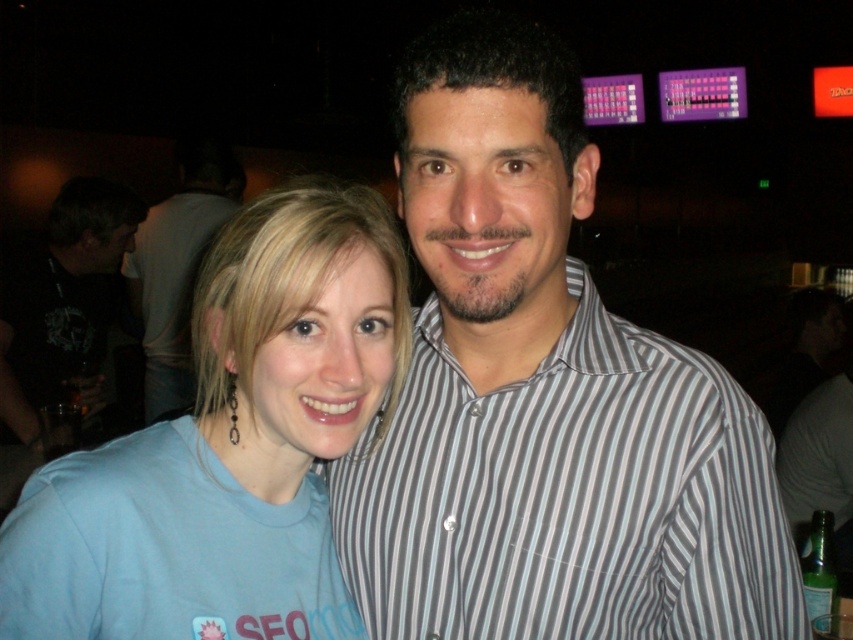
Question: Where is striped cotton shirt at center located in relation to black matte shirt at left in the image?

Choices:
 (A) left
 (B) right

Answer: (B)

Question: Does black matte shirt at left appear under matte black shirt at center?

Choices:
 (A) no
 (B) yes

Answer: (B)

Question: Which point is farther from the camera taking this photo?

Choices:
 (A) (529, 493)
 (B) (111, 584)
 (C) (67, 291)

Answer: (C)

Question: Is light blue t-shirt at center bigger than matte black shirt at center?

Choices:
 (A) yes
 (B) no

Answer: (B)

Question: Which object is closer to the camera taking this photo?

Choices:
 (A) striped cotton shirt at center
 (B) light blue t-shirt at center

Answer: (B)

Question: Which object is the closest to the black matte shirt at left?

Choices:
 (A) matte black shirt at center
 (B) light blue t-shirt at center

Answer: (A)